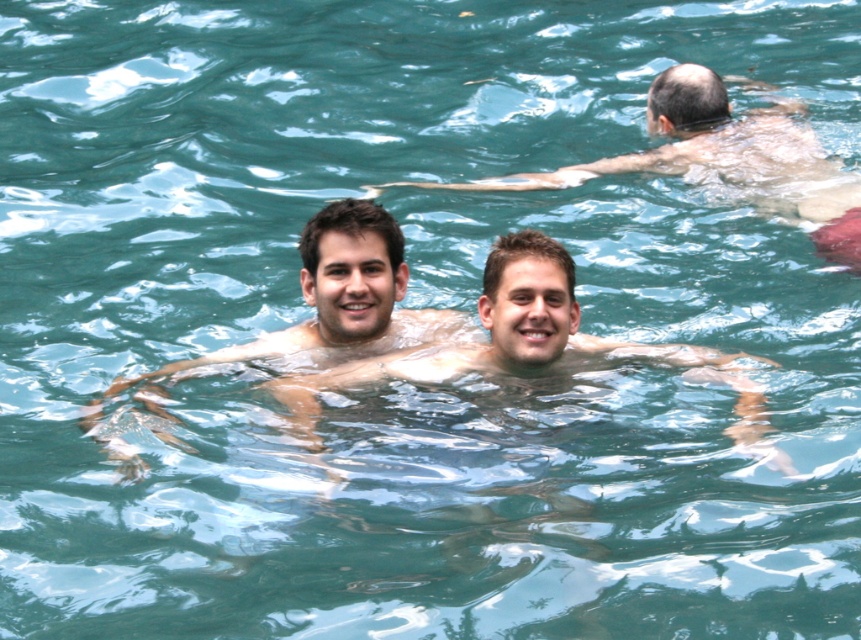
Question: Is smooth skin man at center bigger than smooth skin man at upper center?

Choices:
 (A) yes
 (B) no

Answer: (B)

Question: Considering the real-world distances, which object is closest to the smooth skin at center?

Choices:
 (A) smooth skin man at upper center
 (B) smooth skin man at center

Answer: (B)

Question: Does smooth skin man at center have a larger size compared to smooth skin at center?

Choices:
 (A) no
 (B) yes

Answer: (A)

Question: Is smooth skin at center bigger than smooth skin man at upper center?

Choices:
 (A) no
 (B) yes

Answer: (A)

Question: Which of the following is the closest to the observer?

Choices:
 (A) smooth skin man at upper center
 (B) smooth skin man at center

Answer: (B)

Question: Which point appears closest to the camera in this image?

Choices:
 (A) (497, 301)
 (B) (586, 166)

Answer: (A)